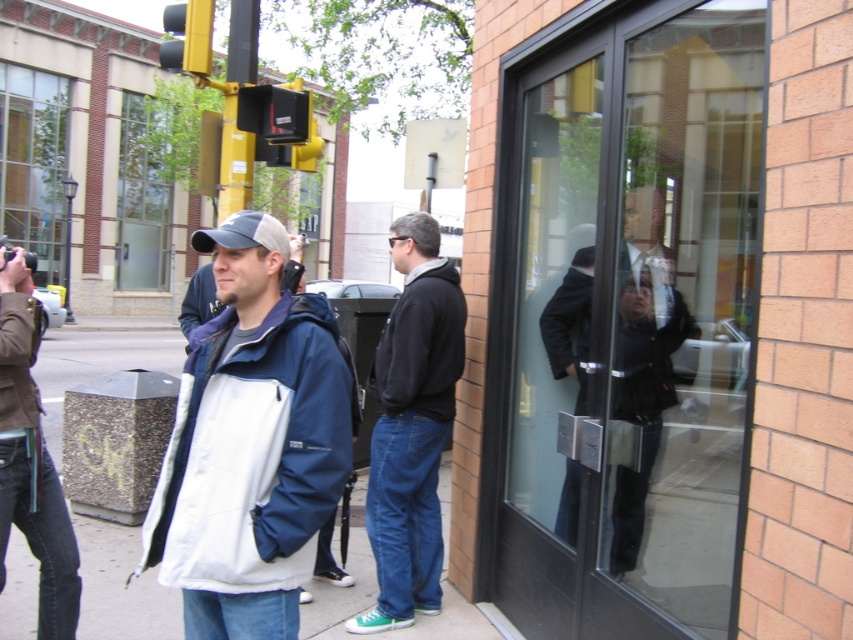
Who is positioned more to the left, white matte jacket at center or brown leather jacket at left?

From the viewer's perspective, brown leather jacket at left appears more on the left side.

Which is in front, point (303, 545) or point (0, 516)?

Positioned in front is point (303, 545).

Who is more forward, (299, 461) or (57, 609)?

Positioned in front is point (299, 461).

You are a GUI agent. You are given a task and a screenshot of the screen. Output one action in this format:
    pyautogui.click(x=<x>, y=<y>)
    Task: Click on the white matte jacket at center
    
    Given the screenshot: What is the action you would take?
    pyautogui.click(x=251, y=444)

This screenshot has width=853, height=640. What do you see at coordinates (627, 323) in the screenshot?
I see `transparent glass door at center` at bounding box center [627, 323].

Is transparent glass door at center positioned behind dark suit at center?

No, transparent glass door at center is in front of dark suit at center.

Which is behind, point (728, 22) or point (554, 310)?

The point (554, 310) is behind.

Where is `transparent glass door at center`? Image resolution: width=853 pixels, height=640 pixels. transparent glass door at center is located at coordinates (627, 323).

Is white fabric pavement at center shorter than black plastic traffic light at upper center?

No.

Is white fabric pavement at center to the left of black plastic traffic light at upper center from the viewer's perspective?

Indeed, white fabric pavement at center is positioned on the left side of black plastic traffic light at upper center.

Locate an element on the screen. The width and height of the screenshot is (853, 640). white fabric pavement at center is located at coordinates (120, 586).